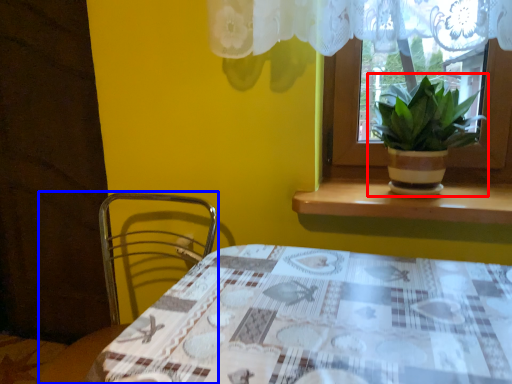
Question: Which point is further to the camera, houseplant (highlighted by a red box) or chair (highlighted by a blue box)?

Choices:
 (A) houseplant
 (B) chair

Answer: (A)